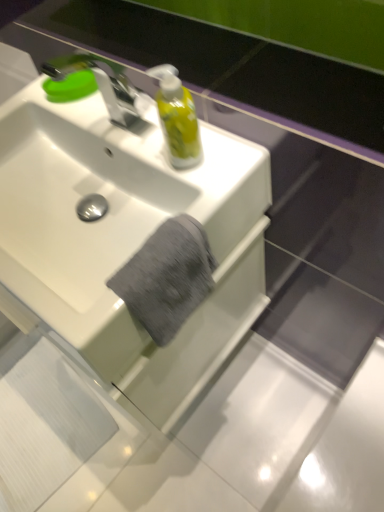
Where is `free space in front of translucent yellow liquid at upper center`? This screenshot has width=384, height=512. free space in front of translucent yellow liquid at upper center is located at coordinates (209, 183).